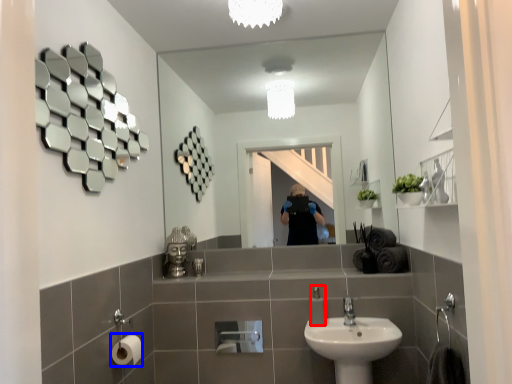
Question: Which object appears farthest to the camera in this image, soap dispenser (highlighted by a red box) or toilet paper (highlighted by a blue box)?

Choices:
 (A) soap dispenser
 (B) toilet paper

Answer: (A)